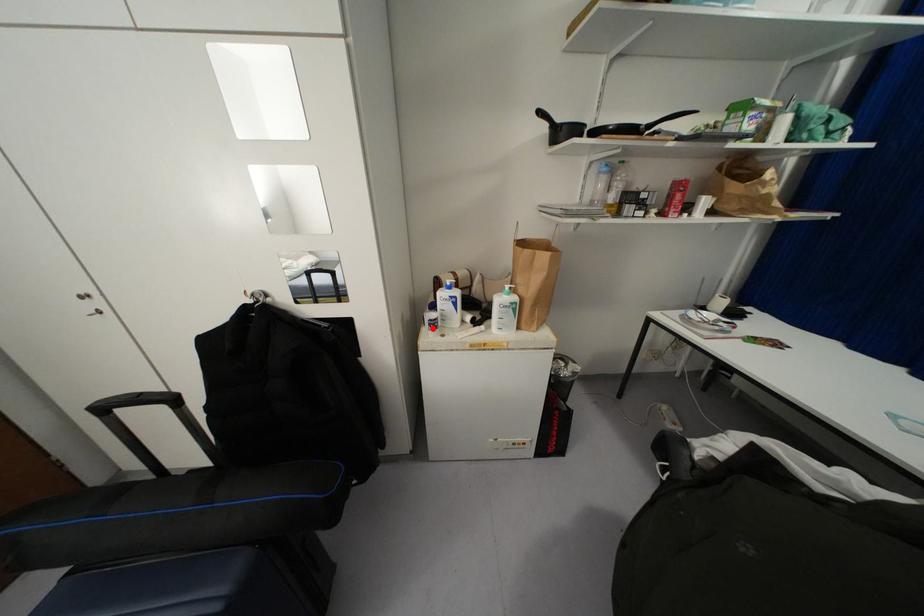
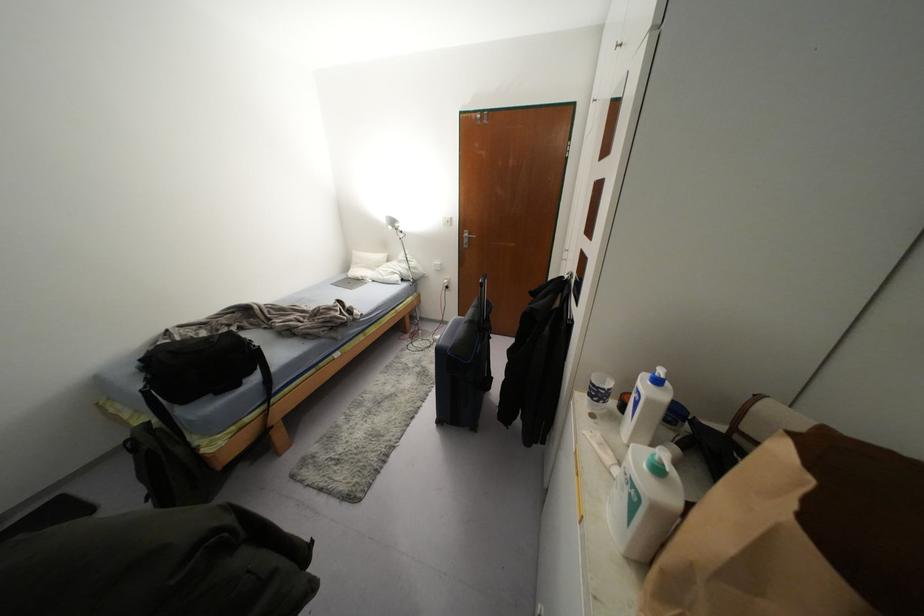
Where in the second image is the point corresponding to the highlighted location from the first image?

(590, 395)